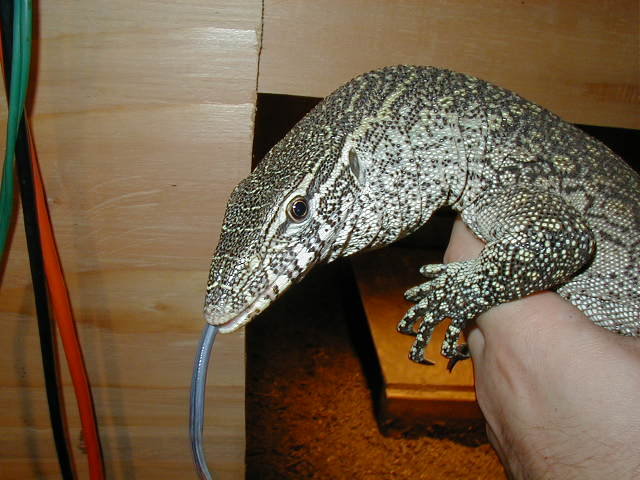
The height and width of the screenshot is (480, 640). What are the coordinates of `extension chord` in the screenshot? It's located at (27, 54).